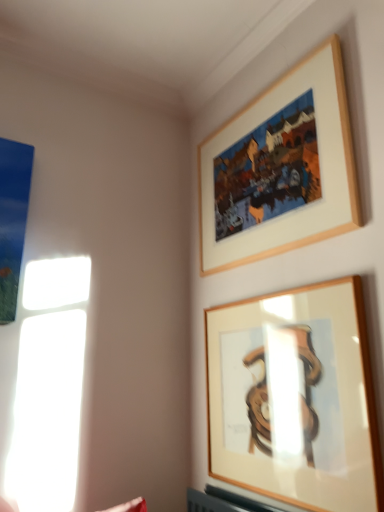
Question: Which direction should I rotate to look at wooden frame at upper center, marked as the 1th picture frame in a bottom-to-top arrangement, — up or down?

Choices:
 (A) up
 (B) down

Answer: (B)

Question: Can you confirm if wooden frame at upper center, the first picture frame in the top-to-bottom sequence, is shorter than wooden frame at upper center, marked as the 1th picture frame in a bottom-to-top arrangement?

Choices:
 (A) no
 (B) yes

Answer: (A)

Question: Can you confirm if wooden frame at upper center, which ranks as the second picture frame in bottom-to-top order, is taller than wooden frame at upper center, positioned as the second picture frame in top-to-bottom order?

Choices:
 (A) yes
 (B) no

Answer: (A)

Question: Could you tell me if wooden frame at upper center, which ranks as the second picture frame in bottom-to-top order, is facing wooden frame at upper center, marked as the 1th picture frame in a bottom-to-top arrangement?

Choices:
 (A) yes
 (B) no

Answer: (B)

Question: Can you confirm if wooden frame at upper center, the first picture frame in the top-to-bottom sequence, is bigger than wooden frame at upper center, positioned as the second picture frame in top-to-bottom order?

Choices:
 (A) yes
 (B) no

Answer: (A)

Question: Are wooden frame at upper center, the first picture frame in the top-to-bottom sequence, and wooden frame at upper center, marked as the 1th picture frame in a bottom-to-top arrangement, making contact?

Choices:
 (A) yes
 (B) no

Answer: (B)

Question: Is wooden frame at upper center, which ranks as the second picture frame in bottom-to-top order, completely or partially outside of wooden frame at upper center, positioned as the second picture frame in top-to-bottom order?

Choices:
 (A) yes
 (B) no

Answer: (A)

Question: Is wooden frame at upper center, positioned as the second picture frame in top-to-bottom order, aimed at wooden frame at upper center, which ranks as the second picture frame in bottom-to-top order?

Choices:
 (A) yes
 (B) no

Answer: (B)

Question: Is wooden frame at upper center, positioned as the second picture frame in top-to-bottom order, directly adjacent to wooden frame at upper center, the first picture frame in the top-to-bottom sequence?

Choices:
 (A) yes
 (B) no

Answer: (B)

Question: Is there a large distance between wooden frame at upper center, positioned as the second picture frame in top-to-bottom order, and wooden frame at upper center, the first picture frame in the top-to-bottom sequence?

Choices:
 (A) yes
 (B) no

Answer: (B)

Question: Can you confirm if wooden frame at upper center, marked as the 1th picture frame in a bottom-to-top arrangement, is positioned to the left of wooden frame at upper center, the first picture frame in the top-to-bottom sequence?

Choices:
 (A) no
 (B) yes

Answer: (A)

Question: Is wooden frame at upper center, marked as the 1th picture frame in a bottom-to-top arrangement, closer to the viewer compared to wooden frame at upper center, the first picture frame in the top-to-bottom sequence?

Choices:
 (A) yes
 (B) no

Answer: (A)

Question: Considering the relative sizes of wooden frame at upper center, marked as the 1th picture frame in a bottom-to-top arrangement, and wooden frame at upper center, which ranks as the second picture frame in bottom-to-top order, in the image provided, is wooden frame at upper center, marked as the 1th picture frame in a bottom-to-top arrangement, shorter than wooden frame at upper center, which ranks as the second picture frame in bottom-to-top order,?

Choices:
 (A) yes
 (B) no

Answer: (A)

Question: Is wooden frame at upper center, marked as the 1th picture frame in a bottom-to-top arrangement, wider or thinner than wooden frame at upper center, which ranks as the second picture frame in bottom-to-top order?

Choices:
 (A) thin
 (B) wide

Answer: (A)